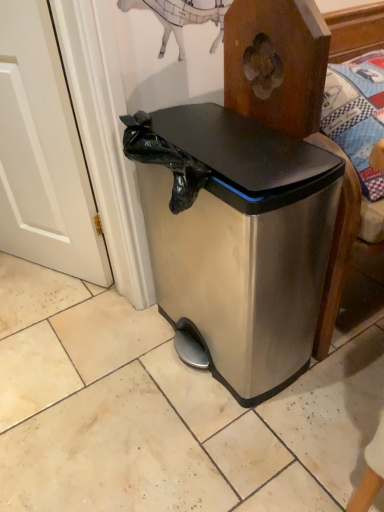
Locate an element on the screen. vacant area situated below stainless steel trash can at center (from a real-world perspective) is located at coordinates (209, 345).